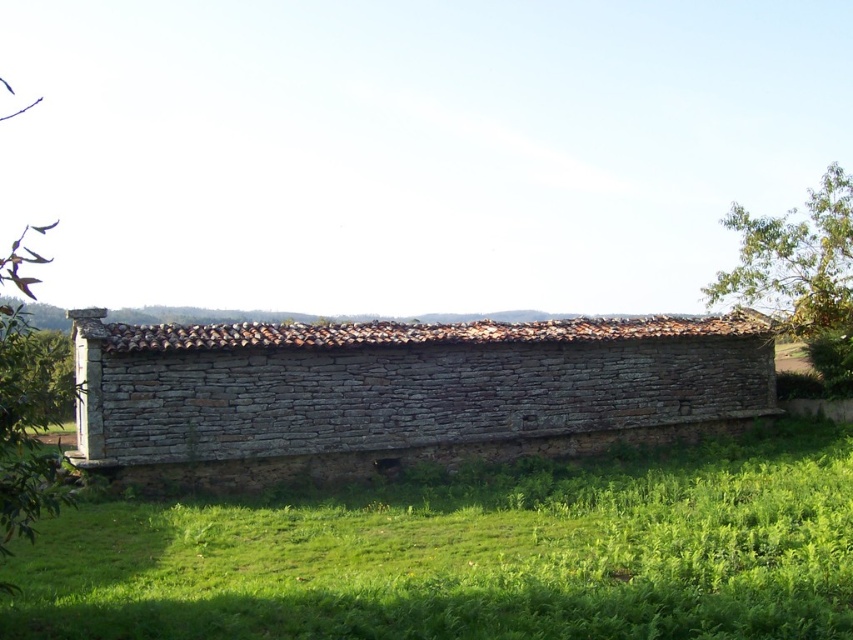
Question: Can you confirm if green grass at lower center is positioned to the left of gray stone hut at center?

Choices:
 (A) no
 (B) yes

Answer: (A)

Question: Does gray stone hut at center have a smaller size compared to green leafy tree at upper right?

Choices:
 (A) no
 (B) yes

Answer: (B)

Question: Does green grass at lower center have a greater width compared to gray stone hut at center?

Choices:
 (A) yes
 (B) no

Answer: (B)

Question: Considering the real-world distances, which object is closest to the green grass at lower center?

Choices:
 (A) green leafy tree at upper right
 (B) gray stone hut at center

Answer: (B)

Question: Which is farther from the gray stone hut at center?

Choices:
 (A) green leafy tree at upper right
 (B) green grass at lower center

Answer: (A)

Question: Which of these objects is positioned farthest from the green grass at lower center?

Choices:
 (A) green leafy tree at upper right
 (B) gray stone hut at center

Answer: (A)